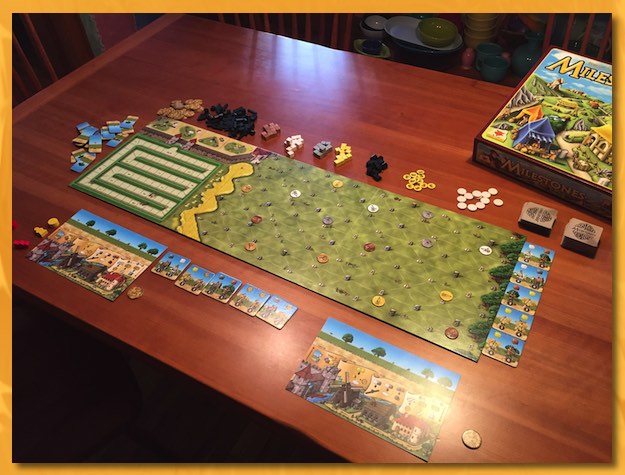
You are a GUI agent. You are given a task and a screenshot of the screen. Output one action in this format:
    pyautogui.click(x=<x>, y=<y>)
    Task: Click on the white bowl
    The image size is (625, 475).
    Given the screenshot: What is the action you would take?
    pyautogui.click(x=399, y=27), pyautogui.click(x=378, y=17), pyautogui.click(x=370, y=34)